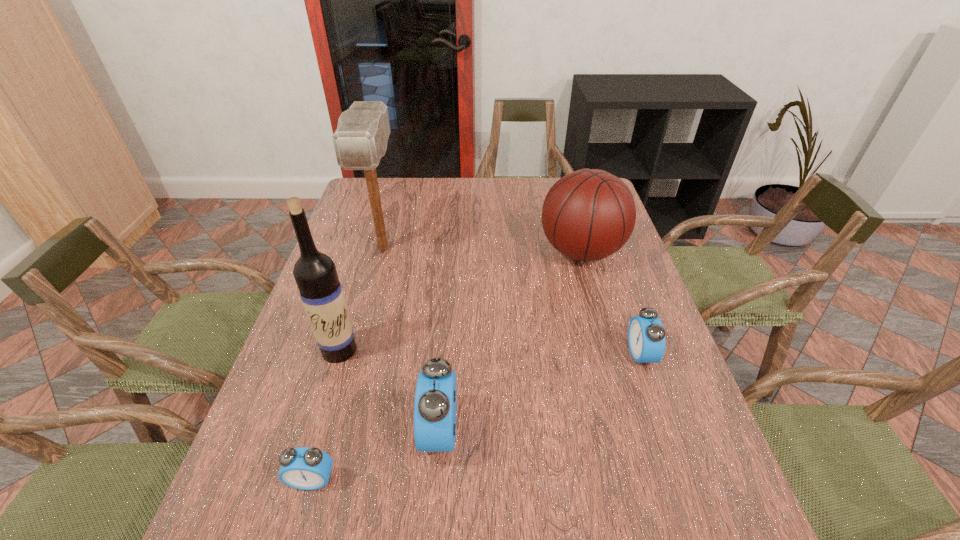
Locate an element on the screen. This screenshot has width=960, height=540. the leftmost alarm clock is located at coordinates (304, 468).

You are a GUI agent. You are given a task and a screenshot of the screen. Output one action in this format:
    pyautogui.click(x=<x>, y=<y>)
    Task: Click on the nearest object
    This screenshot has width=960, height=540.
    Given the screenshot: What is the action you would take?
    pyautogui.click(x=304, y=468)

You are a GUI agent. You are given a task and a screenshot of the screen. Output one action in this format:
    pyautogui.click(x=<x>, y=<y>)
    Task: Click on the second nearest object
    
    Given the screenshot: What is the action you would take?
    pyautogui.click(x=435, y=406)

This screenshot has width=960, height=540. In order to click on the third shortest object in this screenshot , I will do `click(435, 406)`.

The height and width of the screenshot is (540, 960). I want to click on the farthest alarm clock, so click(646, 336).

Where is `the second shortest object`? the second shortest object is located at coordinates (646, 336).

I want to click on mallet, so click(x=360, y=141).

Locate an element on the screen. the third tallest object is located at coordinates (589, 214).

Locate an element on the screen. wine bottle is located at coordinates (315, 273).

Locate an element on the screen. The height and width of the screenshot is (540, 960). vacant space located on the face of the third object from right to left is located at coordinates (316, 431).